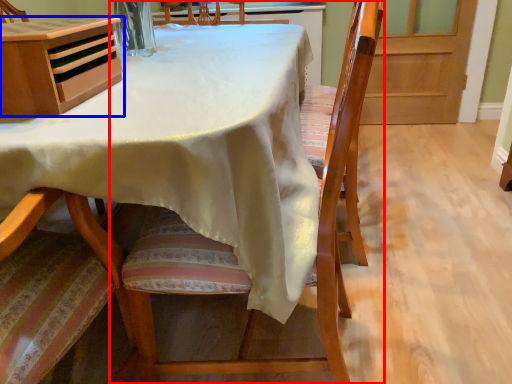
Question: Which of the following is the closest to the observer, chair (highlighted by a red box) or cabinetry (highlighted by a blue box)?

Choices:
 (A) chair
 (B) cabinetry

Answer: (A)